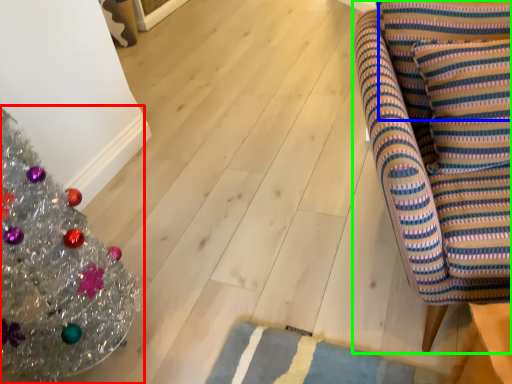
Question: Which object is the farthest from christmas tree (highlighted by a red box)? Choose among these: pillow (highlighted by a blue box) or furniture (highlighted by a green box).

Choices:
 (A) pillow
 (B) furniture

Answer: (A)